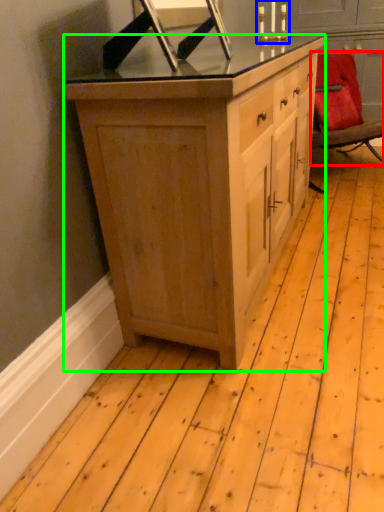
Question: Estimate the real-world distances between objects in this image. Which object is farther from chair (highlighted by a red box), candle holder (highlighted by a blue box) or cabinetry (highlighted by a green box)?

Choices:
 (A) candle holder
 (B) cabinetry

Answer: (B)